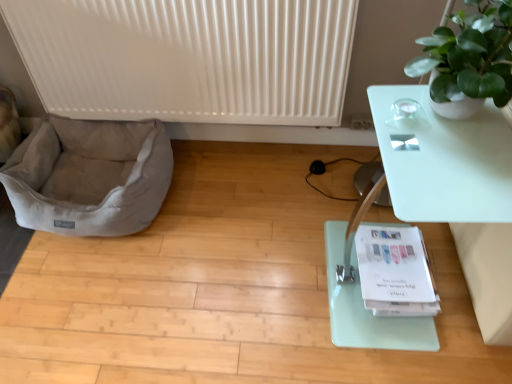
Image resolution: width=512 pixels, height=384 pixels. Identify the location of free space in front of light gray fabric dog bed at lower left. (95, 297).